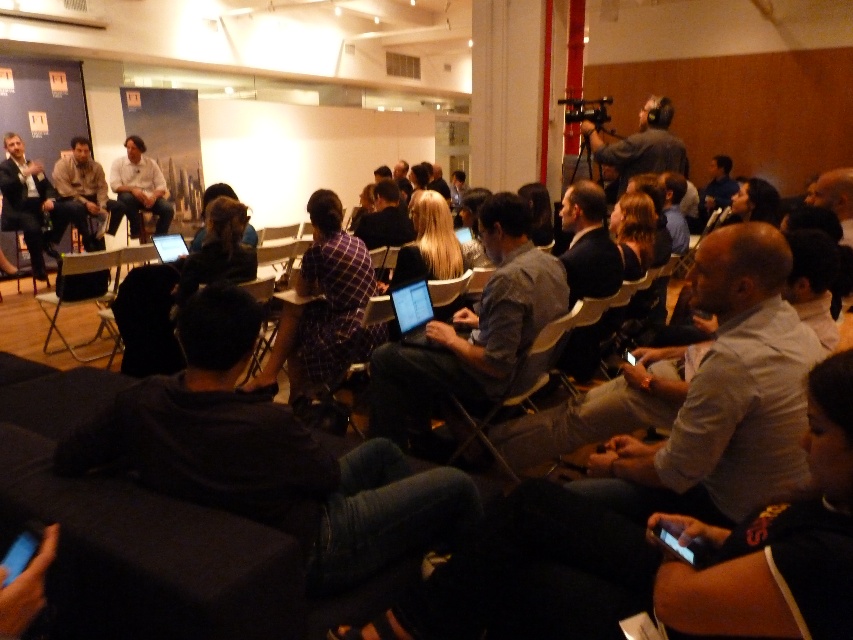
Question: Does black plastic chair at left have a smaller size compared to white shirt at center?

Choices:
 (A) no
 (B) yes

Answer: (A)

Question: Estimate the real-world distances between objects in this image. Which object is farther from the metallic silver chair at center?

Choices:
 (A) black plastic chair at left
 (B) matte brown jacket at left
 (C) plaid fabric shirt at center

Answer: (B)

Question: Which of the following is the farthest from the observer?

Choices:
 (A) (144, 209)
 (B) (393, 275)
 (C) (500, 404)

Answer: (A)

Question: Which point appears farthest from the camera in this image?

Choices:
 (A) (160, 214)
 (B) (21, 172)

Answer: (A)

Question: Is plaid fabric shirt at center to the right of matte brown jacket at left from the viewer's perspective?

Choices:
 (A) yes
 (B) no

Answer: (A)

Question: Considering the relative positions of black plastic chair at left and white shirt at center in the image provided, where is black plastic chair at left located with respect to white shirt at center?

Choices:
 (A) above
 (B) below

Answer: (B)